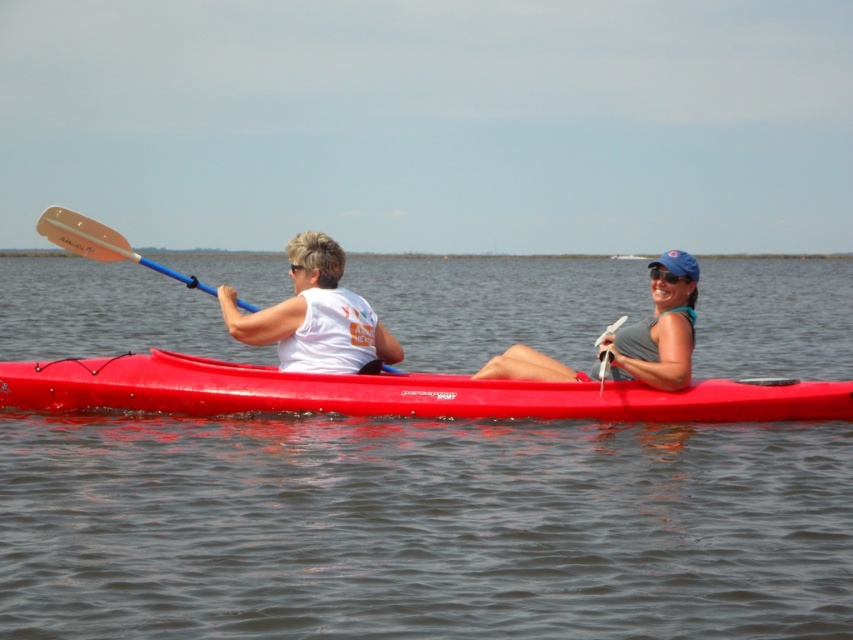
Can you confirm if white matte tank top at center is taller than translucent plastic paddle at left?

Incorrect, white matte tank top at center's height is not larger of translucent plastic paddle at left's.

Locate an element on the screen. white matte tank top at center is located at coordinates (314, 316).

Is point (711, 627) farther from viewer compared to point (502, 392)?

No, it is not.

Does point (459, 582) lie behind point (254, 369)?

No, it is not.

This screenshot has width=853, height=640. Find the location of `transparent water at center`. transparent water at center is located at coordinates (421, 528).

Which is below, translucent plastic paddle at left or blue matte sunglasses at upper center?

blue matte sunglasses at upper center is lower down.

Measure the distance between point (80, 227) and camera.

They are 12.16 meters apart.

The height and width of the screenshot is (640, 853). I want to click on translucent plastic paddle at left, so click(99, 243).